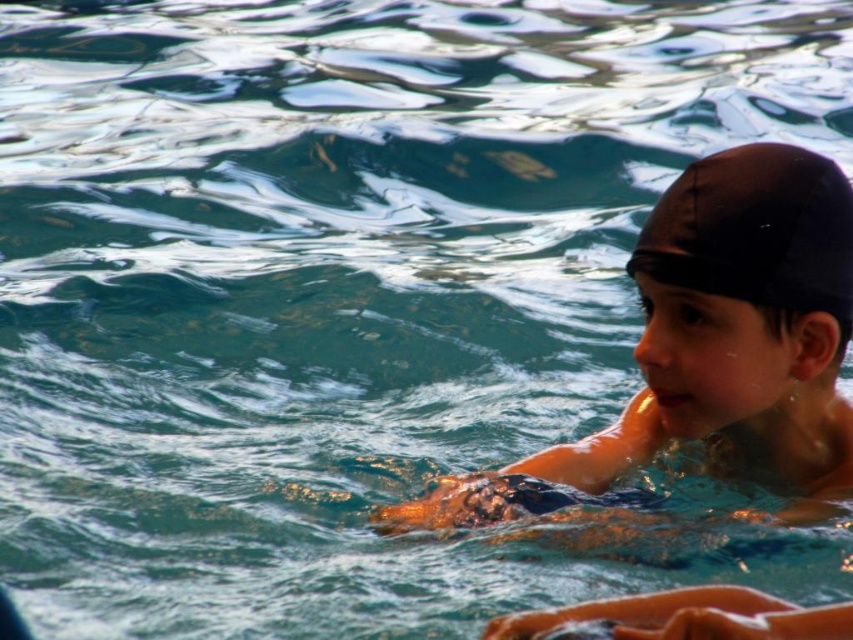
You are a lifeguard observing the pool area. You notice two objects labeled as matte black swim cap at upper right and black matte swim cap at upper right. Which one is taller?

The matte black swim cap at upper right is taller than the black matte swim cap at upper right according to the description.

You are a lifeguard observing the pool from above. There is a point marked at coordinates (712, 348). What object is located at that point?

The point at coordinates (712, 348) corresponds to the matte black swim cap at upper right.